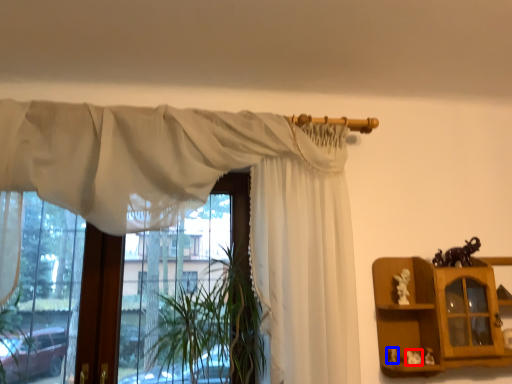
Question: Which point is closer to the camera, toy (highlighted by a red box) or toy (highlighted by a blue box)?

Choices:
 (A) toy
 (B) toy

Answer: (A)